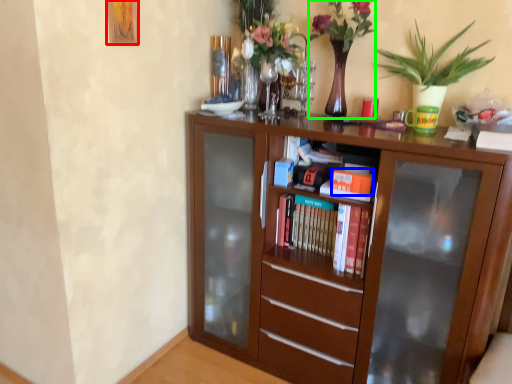
Question: Considering the real-world distances, which object is closest to picture frame (highlighted by a red box)? book (highlighted by a blue box) or floral arrangement (highlighted by a green box).

Choices:
 (A) book
 (B) floral arrangement

Answer: (B)